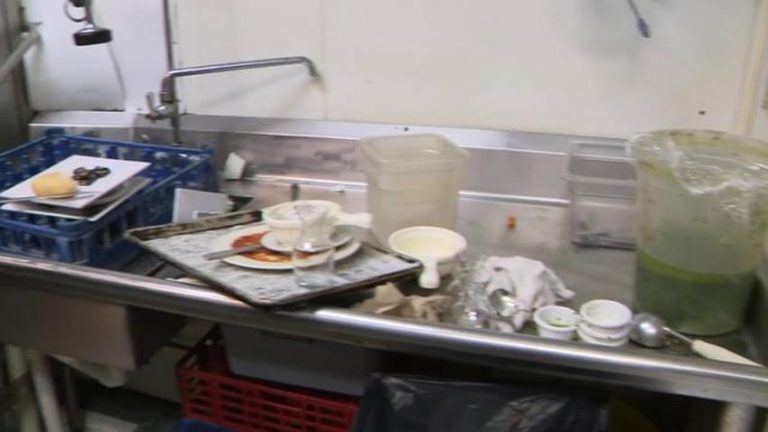
The image size is (768, 432). Find the location of `storage bin`. storage bin is located at coordinates (141, 256), (551, 330), (597, 323), (606, 330), (608, 342), (437, 252), (399, 189).